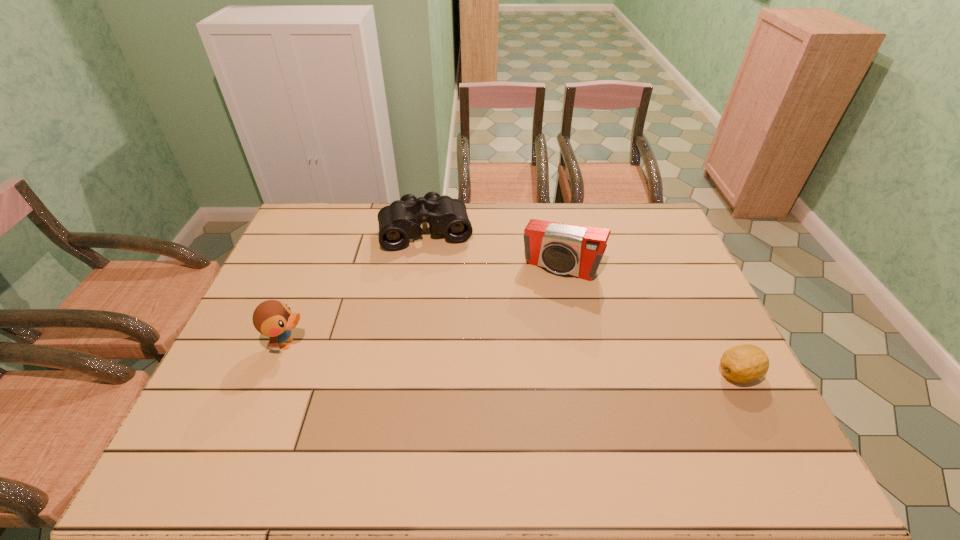
Identify the location of empty space that is in between the second nearest object and the camera. This screenshot has width=960, height=540. (424, 305).

This screenshot has width=960, height=540. Find the location of `vacant space that's between the second object from right to left and the third object from right to left`. vacant space that's between the second object from right to left and the third object from right to left is located at coordinates (493, 249).

Where is `vacant area that lies between the third object from right to left and the third farthest object`? The height and width of the screenshot is (540, 960). vacant area that lies between the third object from right to left and the third farthest object is located at coordinates (357, 287).

Identify the location of free spot between the camera and the lemon. The image size is (960, 540). (650, 320).

The height and width of the screenshot is (540, 960). I want to click on empty space that is in between the third object from left to right and the third object from right to left, so click(x=493, y=249).

Locate an element on the screen. The image size is (960, 540). the third closest object to the third tallest object is located at coordinates (745, 363).

Choose which object is the nearest neighbor to the camera. Please provide its 2D coordinates. Your answer should be formatted as a tuple, i.e. [(x, y)], where the tuple contains the x and y coordinates of a point satisfying the conditions above.

[(401, 220)]

At what (x,y) coordinates should I click in order to perform the action: click on vacant space that satisfies the following two spatial constraints: 1. on the front side of the lemon; 2. at the stem end of the third object from left to right. Please return your answer as a coordinate pair (x, y). This screenshot has height=540, width=960. Looking at the image, I should click on (582, 374).

At what (x,y) coordinates should I click in order to perform the action: click on free space that satisfies the following two spatial constraints: 1. on the front side of the third object from left to right; 2. on the right side of the binoculars. Please return your answer as a coordinate pair (x, y). The image size is (960, 540). Looking at the image, I should click on (420, 267).